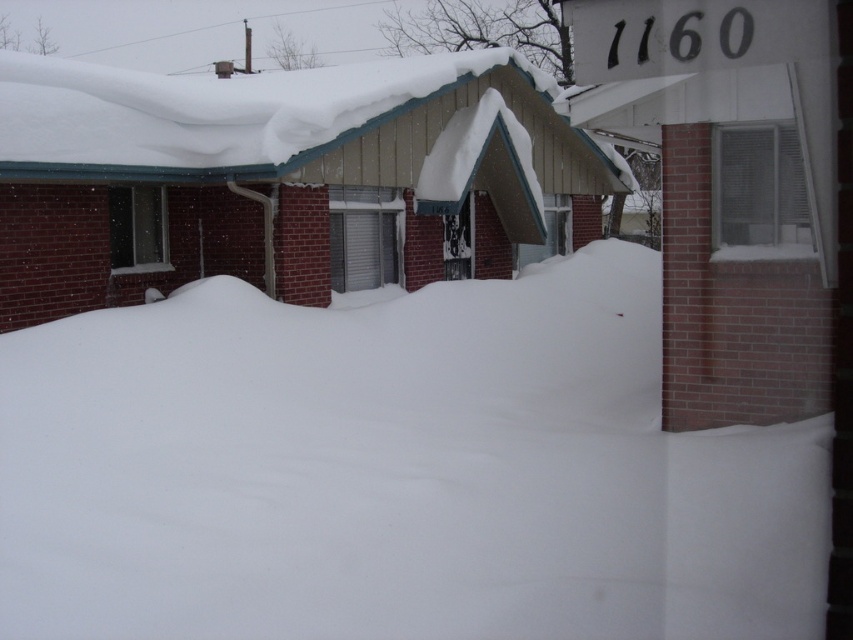
You are standing in the snowy residential area and want to determine which of the two points, point (527, 576) or point (35, 92), is nearer to you. Based on the image, which point is closer?

Point (527, 576) is closer to the camera than point (35, 92), so it is the nearer one.

A drone is flying over a snowy residential area. The operator wants to capture a closeup of the white fluffy snow at center. What coordinates should the drone navigate to?

The drone should navigate to coordinates point (393,472) to capture the white fluffy snow at center.